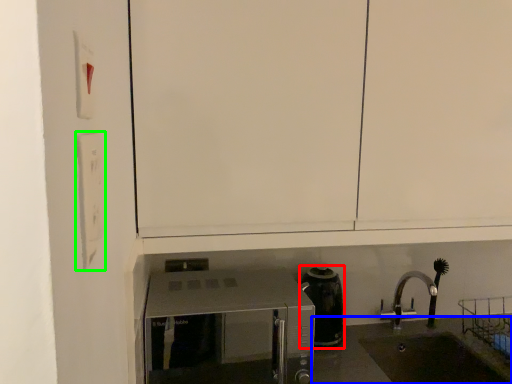
Question: Estimate the real-world distances between objects in this image. Which object is closer to coffeepot (highlighted by a red box), counter top (highlighted by a blue box) or light switch (highlighted by a green box)?

Choices:
 (A) counter top
 (B) light switch

Answer: (A)